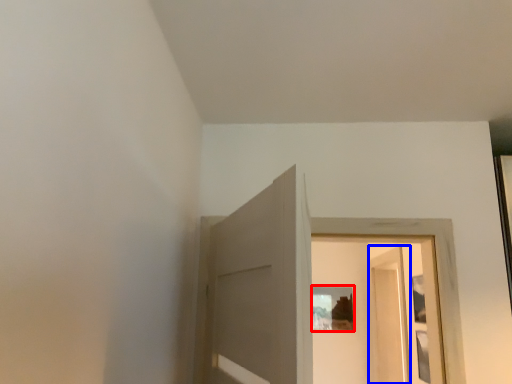
Question: Among these objects, which one is farthest to the camera, picture frame (highlighted by a red box) or screen door (highlighted by a blue box)?

Choices:
 (A) picture frame
 (B) screen door

Answer: (A)